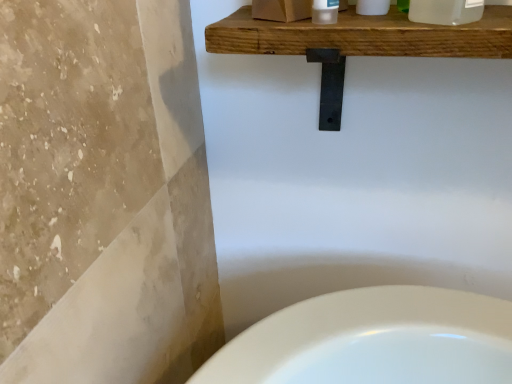
Question: Based on their sizes in the image, would you say transparent plastic bottle at upper right is bigger or smaller than wooden shelf at upper center?

Choices:
 (A) big
 (B) small

Answer: (B)

Question: From a real-world perspective, is transparent plastic bottle at upper right above or below wooden shelf at upper center?

Choices:
 (A) above
 (B) below

Answer: (A)

Question: In terms of height, does transparent plastic bottle at upper right look taller or shorter compared to wooden shelf at upper center?

Choices:
 (A) tall
 (B) short

Answer: (B)

Question: Which is correct: wooden shelf at upper center is inside transparent plastic bottle at upper right, or outside of it?

Choices:
 (A) outside
 (B) inside

Answer: (A)

Question: Is wooden shelf at upper center to the left or to the right of transparent plastic bottle at upper right in the image?

Choices:
 (A) left
 (B) right

Answer: (A)

Question: Looking at their shapes, would you say wooden shelf at upper center is wider or thinner than transparent plastic bottle at upper right?

Choices:
 (A) thin
 (B) wide

Answer: (B)

Question: Considering the positions of wooden shelf at upper center and transparent plastic bottle at upper right in the image, is wooden shelf at upper center taller or shorter than transparent plastic bottle at upper right?

Choices:
 (A) short
 (B) tall

Answer: (B)